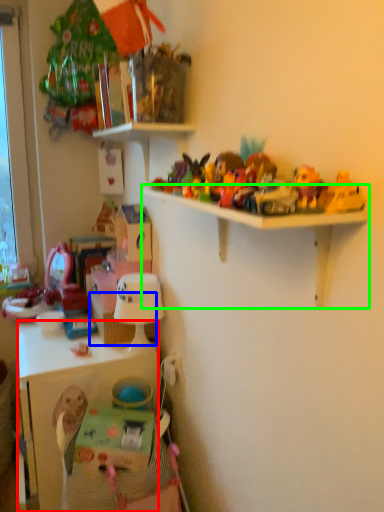
Question: Which object is the farthest from cabinetry (highlighted by a red box)? Choose among these: basket (highlighted by a blue box) or shelf (highlighted by a green box).

Choices:
 (A) basket
 (B) shelf

Answer: (B)